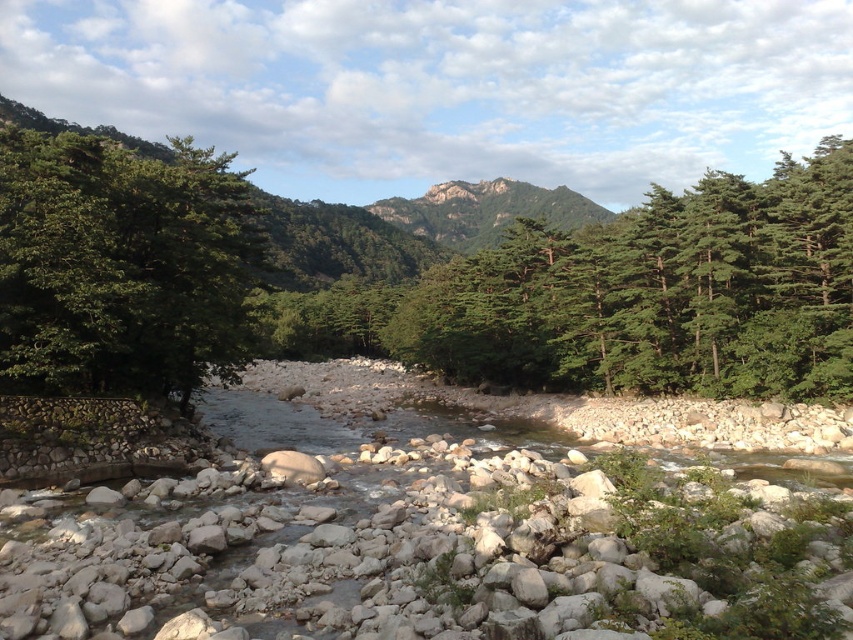
Question: Among these objects, which one is farthest from the camera?

Choices:
 (A) rugged stone mountain at center
 (B) green leafy tree at left

Answer: (A)

Question: Is green textured trees at center further to the viewer compared to green leafy tree at left?

Choices:
 (A) yes
 (B) no

Answer: (A)

Question: Does green textured trees at center come behind rugged stone mountain at center?

Choices:
 (A) no
 (B) yes

Answer: (A)

Question: Which of the following is the closest to the observer?

Choices:
 (A) (561, 193)
 (B) (30, 179)

Answer: (B)

Question: Among these points, which one is nearest to the camera?

Choices:
 (A) (317, 310)
 (B) (4, 209)

Answer: (B)

Question: Does green textured trees at center appear under green leafy tree at left?

Choices:
 (A) yes
 (B) no

Answer: (A)